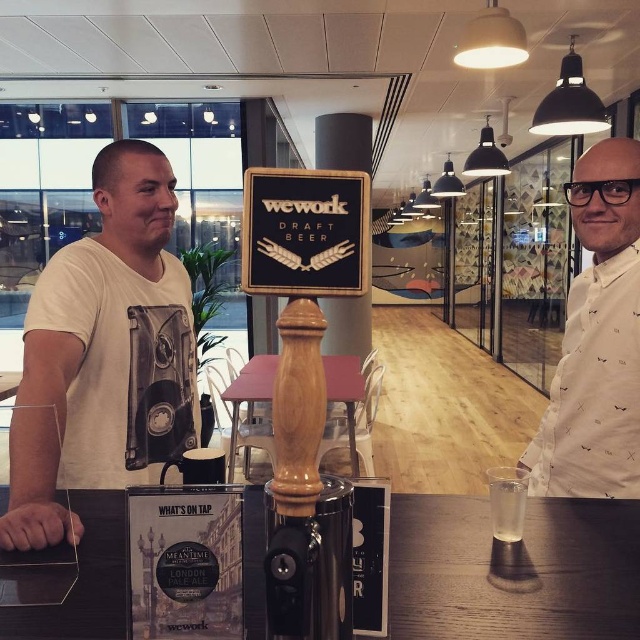
Question: Which point is closer to the camera?

Choices:
 (A) white printed shirt at right
 (B) white cotton t-shirt at left
 (C) translucent glass at center

Answer: (B)

Question: Can you confirm if white cotton t-shirt at left is wider than translucent glass at center?

Choices:
 (A) no
 (B) yes

Answer: (B)

Question: Which object appears farthest from the camera in this image?

Choices:
 (A) white printed shirt at right
 (B) white cotton t-shirt at left

Answer: (A)

Question: Can you confirm if white cotton t-shirt at left is thinner than white printed shirt at right?

Choices:
 (A) yes
 (B) no

Answer: (B)

Question: Is white cotton t-shirt at left further to camera compared to white printed shirt at right?

Choices:
 (A) no
 (B) yes

Answer: (A)

Question: Which point is closer to the camera?

Choices:
 (A) translucent glass at center
 (B) white printed shirt at right
 (C) white cotton t-shirt at left

Answer: (C)